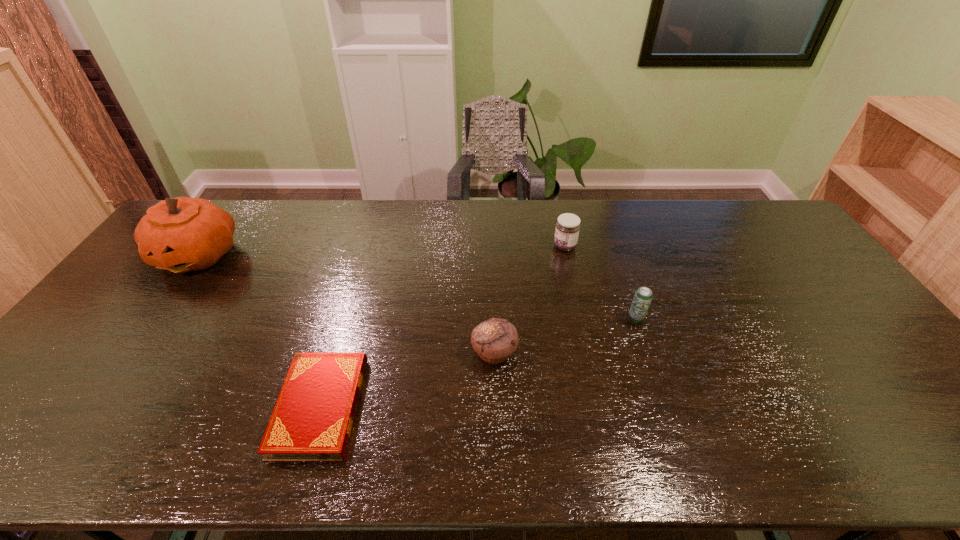
Image resolution: width=960 pixels, height=540 pixels. I want to click on free region that satisfies the following two spatial constraints: 1. on the front label of the jam; 2. on the front-facing side of the pumpkin, so click(x=566, y=254).

This screenshot has height=540, width=960. I want to click on vacant position in the image that satisfies the following two spatial constraints: 1. on the front-facing side of the rightmost object; 2. on the right side of the leftmost object, so click(152, 319).